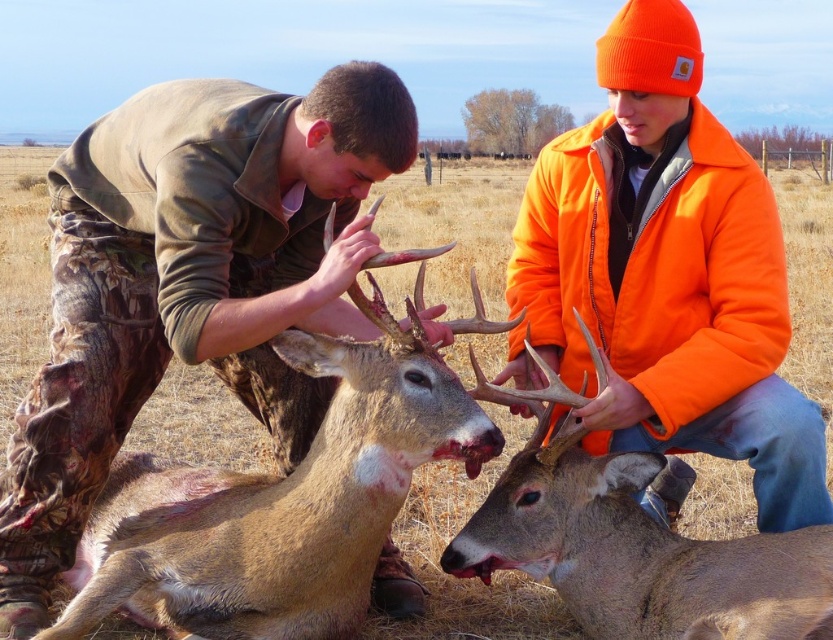
You are a wildlife photographer trying to capture a clear photo of the brown fur deer at center and the brown velvet deer at center. Which deer should you focus on first to ensure it appears sharp in the foreground?

The brown fur deer at center is in front of the brown velvet deer at center, so you should focus on the brown fur deer at center first to ensure it appears sharp in the foreground.

You are a hunter who has spotted two points of interest in the field. The first point is at coordinates point (626,38) and the second is at point (312,627). If you are standing at the second point, which direction should you face to see the first point?

Since point (626,38) is behind point (312,627), you should face backward to see the first point.